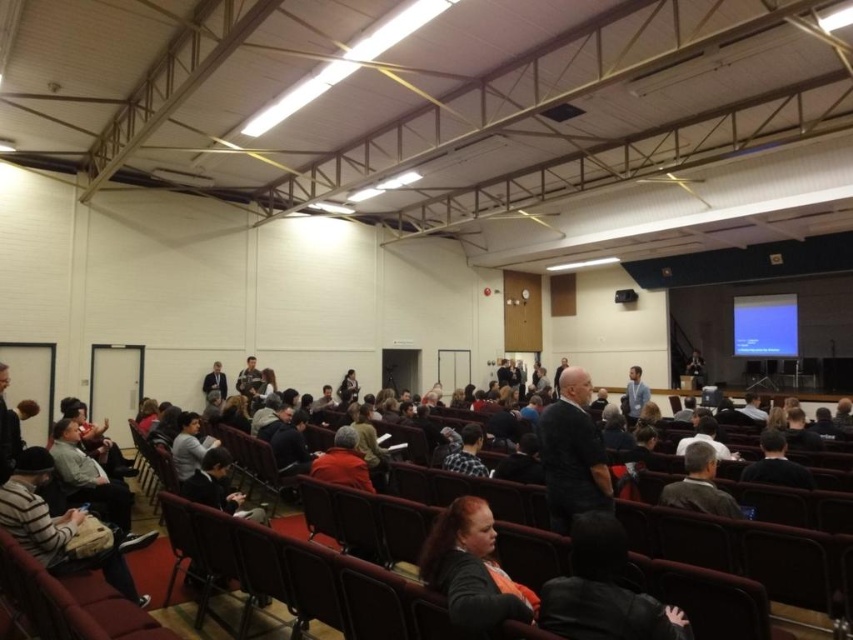
Question: Among these points, which one is farthest from the camera?

Choices:
 (A) (32, 461)
 (B) (639, 378)
 (C) (466, 564)
 (D) (476, 465)

Answer: (B)

Question: Is dark gray sweater at center below light blue shirt at center?

Choices:
 (A) no
 (B) yes

Answer: (B)

Question: Is orange fabric jacket at lower center thinner than striped knit sweater at lower left?

Choices:
 (A) yes
 (B) no

Answer: (A)

Question: Estimate the real-world distances between objects in this image. Which object is farther from the dark gray sweater at center?

Choices:
 (A) plaid fabric shirt at center
 (B) gray wool sweater at center
 (C) light blue shirt at center
 (D) orange fabric jacket at lower center

Answer: (C)

Question: Where is dark gray sweater at center located in relation to light blue shirt at center in the image?

Choices:
 (A) right
 (B) left

Answer: (B)

Question: Among these objects, which one is farthest from the camera?

Choices:
 (A) plaid fabric shirt at center
 (B) orange fabric jacket at lower center
 (C) striped knit sweater at lower left

Answer: (A)